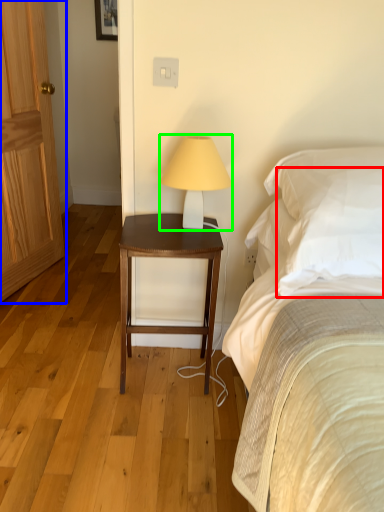
Question: Estimate the real-world distances between objects in this image. Which object is farther from pillow (highlighted by a red box), door (highlighted by a blue box) or table lamp (highlighted by a green box)?

Choices:
 (A) door
 (B) table lamp

Answer: (A)